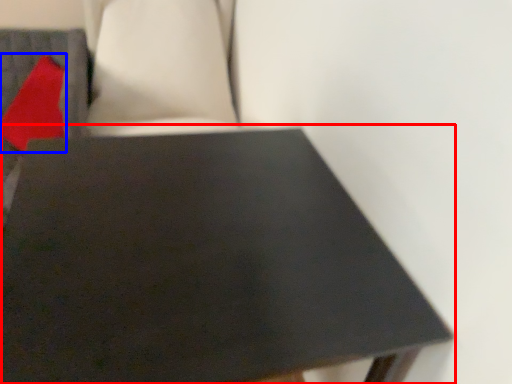
Question: Which object appears farthest to the camera in this image, table (highlighted by a red box) or pillow (highlighted by a blue box)?

Choices:
 (A) table
 (B) pillow

Answer: (B)